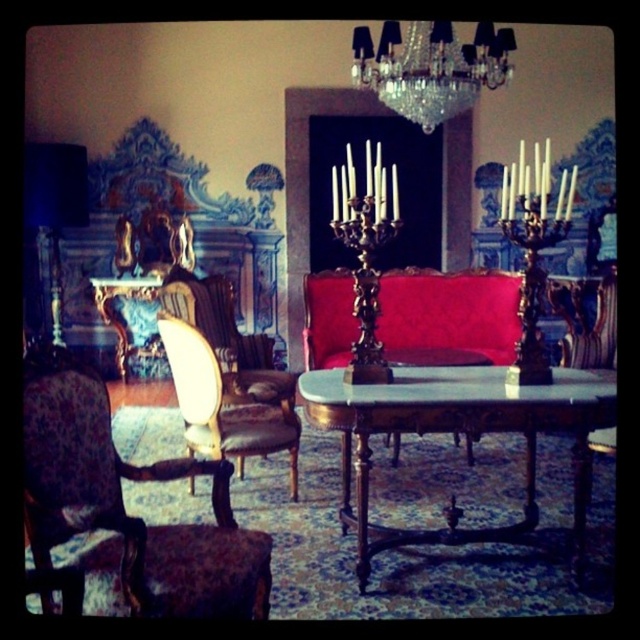
Looking at this image, who is higher up, velvet-patterned armchair at left or gold upholstered armchair at center?

gold upholstered armchair at center

Can you confirm if velvet-patterned armchair at left is positioned to the left of gold upholstered armchair at center?

Indeed, velvet-patterned armchair at left is positioned on the left side of gold upholstered armchair at center.

You are a GUI agent. You are given a task and a screenshot of the screen. Output one action in this format:
    pyautogui.click(x=<x>, y=<y>)
    Task: Click on the velvet-patterned armchair at left
    
    Given the screenshot: What is the action you would take?
    pyautogui.click(x=124, y=506)

Is point (577, 397) positioned behind point (58, 220)?

No, (577, 397) is closer to viewer.

Is point (428, 428) closer to viewer compared to point (36, 202)?

Yes, point (428, 428) is in front of point (36, 202).

Which is in front, point (528, 486) or point (42, 144)?

Point (528, 486) is more forward.

Identify the location of polished wood table at center. The image size is (640, 640). click(458, 432).

Does velvet-patterned armchair at left appear on the left side of velvet red couch at center?

Yes, velvet-patterned armchair at left is to the left of velvet red couch at center.

Is the position of velvet-patterned armchair at left more distant than that of velvet red couch at center?

That is False.

This screenshot has height=640, width=640. Describe the element at coordinates (124, 506) in the screenshot. I see `velvet-patterned armchair at left` at that location.

You are a GUI agent. You are given a task and a screenshot of the screen. Output one action in this format:
    pyautogui.click(x=<x>, y=<y>)
    Task: Click on the velvet-patterned armchair at left
    This screenshot has width=640, height=640.
    Given the screenshot: What is the action you would take?
    pyautogui.click(x=124, y=506)